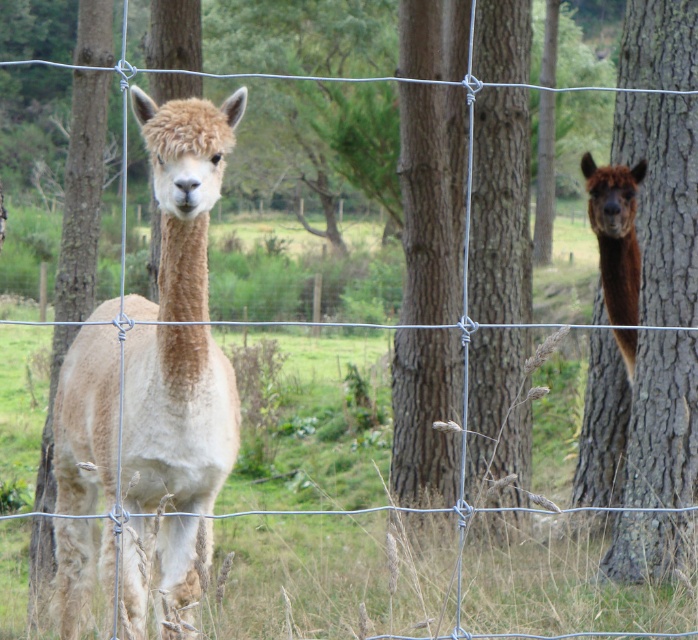
You are a photographer trying to capture both the brown rough bark tree at right and the brown woolly alpaca at right in a single frame. However, the tree is blocking part of the alpaca. Can you adjust your position to ensure the alpaca is fully visible without the tree obstructing it?

The brown rough bark tree at right is positioned over the brown woolly alpaca at right, so moving to the left or right slightly might allow you to reposition the tree so it no longer blocks the alpaca, ensuring the alpaca is fully visible.

You are a photographer trying to capture both the light brown woolen alpaca at center and the brown woolly alpaca at right in a single frame. Given that the camera has a fixed focal length, which alpaca would appear closer to the camera in the photo?

The light brown woolen alpaca at center would appear closer to the camera in the photo because it is larger in size than the brown woolly alpaca at right.